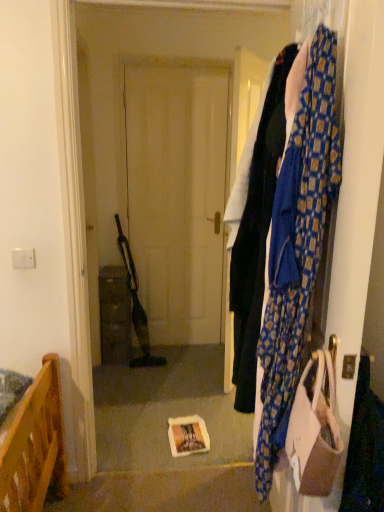
Question: Is brown matte cabinet at center inside the boundaries of beige fabric handbag at right, or outside?

Choices:
 (A) inside
 (B) outside

Answer: (B)

Question: Considering the relative positions of brown matte cabinet at center and beige fabric handbag at right in the image provided, is brown matte cabinet at center to the left or to the right of beige fabric handbag at right?

Choices:
 (A) left
 (B) right

Answer: (A)

Question: Which object is the farthest from the yellow paper book at center?

Choices:
 (A) brown matte cabinet at center
 (B) blue patterned fabric at right
 (C) beige fabric handbag at right
 (D) blue patterned scarf at right

Answer: (D)

Question: Considering the real-world distances, which object is closest to the blue patterned scarf at right?

Choices:
 (A) yellow paper book at center
 (B) beige fabric handbag at right
 (C) brown matte cabinet at center
 (D) blue patterned fabric at right

Answer: (B)